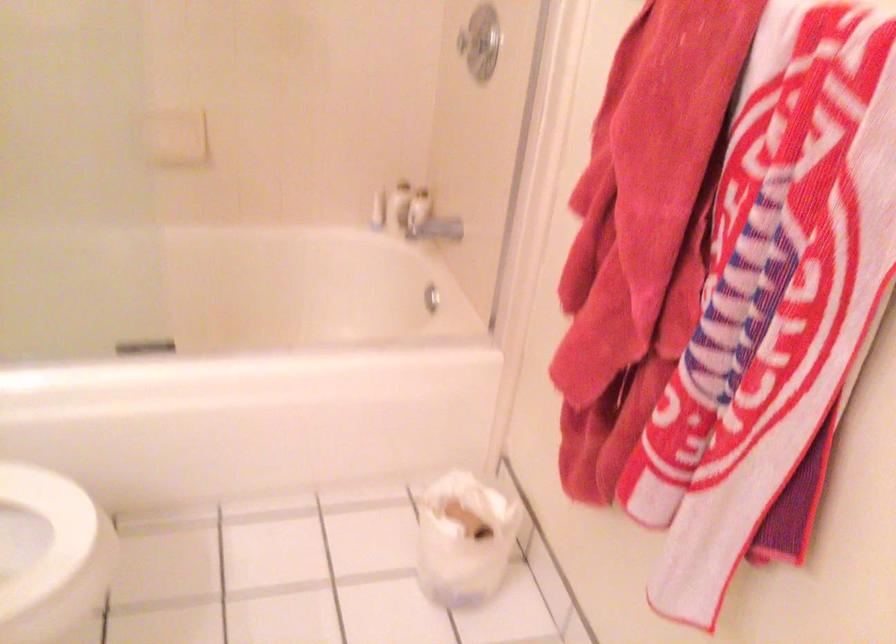
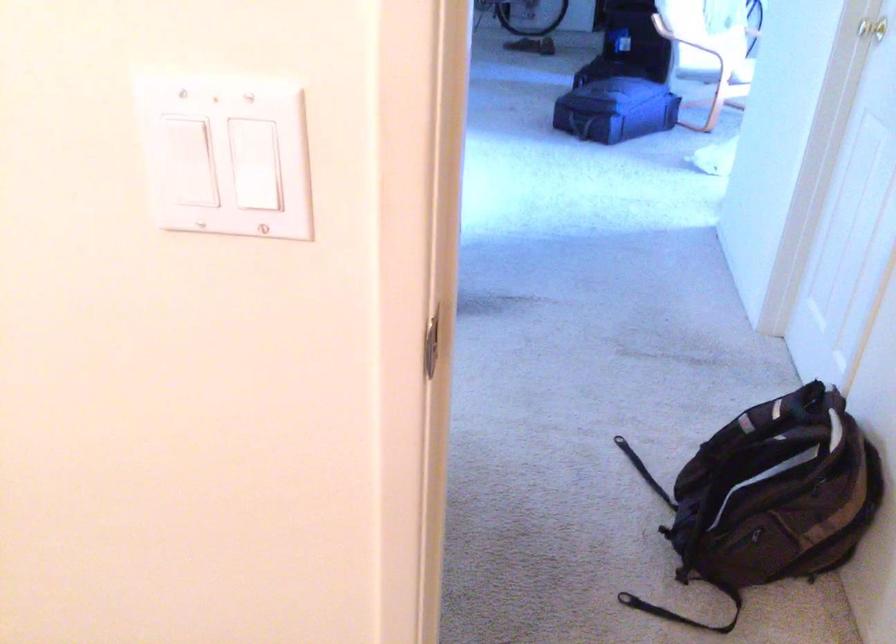
The images are taken continuously from a first-person perspective. In which direction is your viewpoint rotating?

The rotation direction of the camera is right-down.